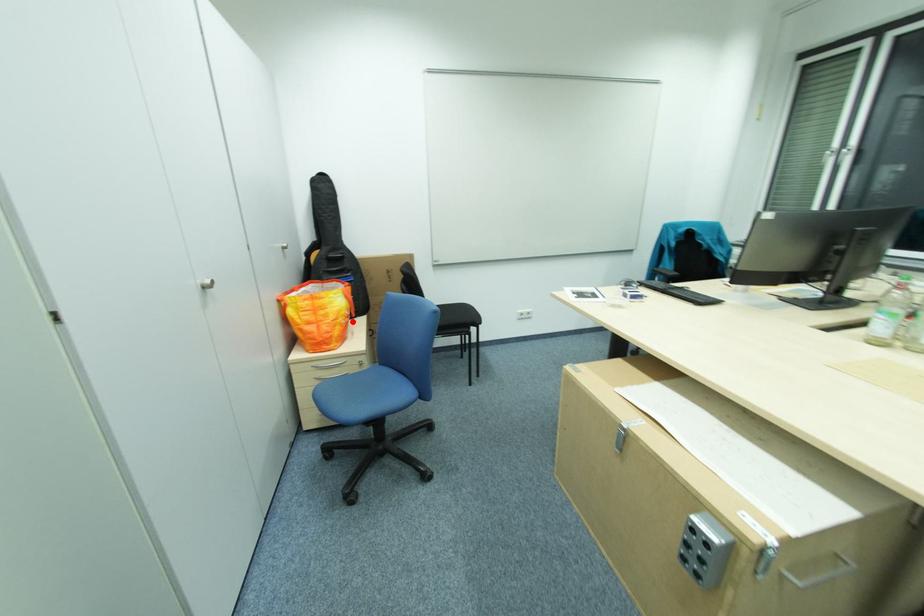
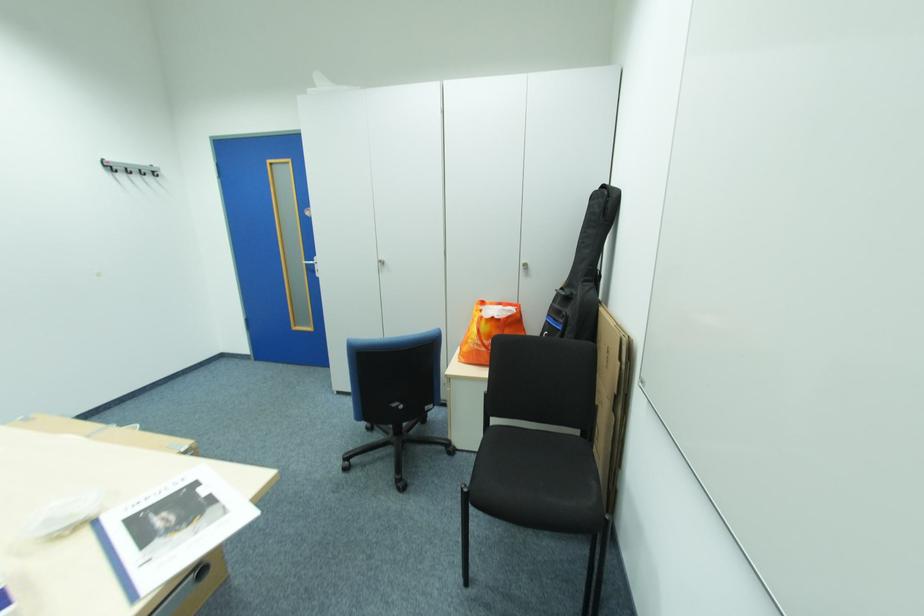
Where in the second image is the point corresponding to the highlighted location from the first image?

(480, 345)